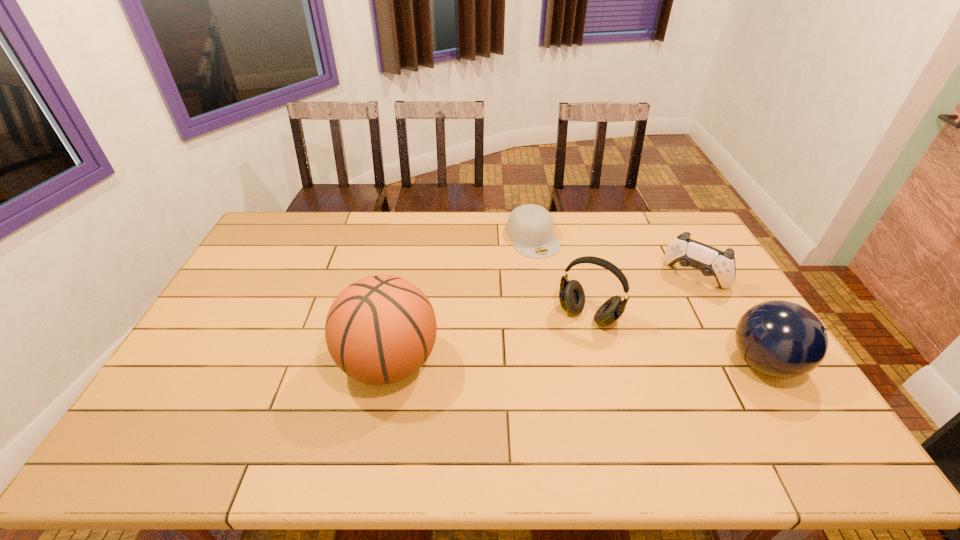
In order to click on free space between the fourth tallest object and the bowling ball in this screenshot , I will do `click(729, 320)`.

The image size is (960, 540). Identify the location of free space that is in between the bowling ball and the leftmost object. (576, 363).

Where is `vacant area that lies between the bowling ball and the control`? vacant area that lies between the bowling ball and the control is located at coordinates (729, 320).

Where is `unoccupied area between the farthest object and the control`? unoccupied area between the farthest object and the control is located at coordinates (613, 258).

You are a GUI agent. You are given a task and a screenshot of the screen. Output one action in this format:
    pyautogui.click(x=<x>, y=<y>)
    Task: Click on the free space between the basketball and the bowling ball
    
    Given the screenshot: What is the action you would take?
    pyautogui.click(x=576, y=363)

Identify the location of free space between the bowling ball and the control. This screenshot has width=960, height=540. (729, 320).

The image size is (960, 540). I want to click on free space that is in between the tallest object and the headset, so click(x=489, y=339).

Find the location of a particular element. This screenshot has width=960, height=540. vacant space in between the tallest object and the headset is located at coordinates (489, 339).

The height and width of the screenshot is (540, 960). Find the location of `free space between the basketball and the farthest object`. free space between the basketball and the farthest object is located at coordinates (461, 300).

I want to click on object that stands as the third closest to the control, so click(x=530, y=227).